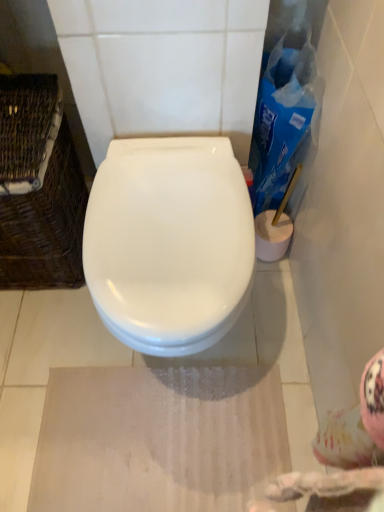
Question: Does point (158, 158) appear closer or farther from the camera than point (31, 260)?

Choices:
 (A) farther
 (B) closer

Answer: (B)

Question: From their relative heights in the image, would you say white glossy toilet at center is taller or shorter than woven brown basket at left?

Choices:
 (A) short
 (B) tall

Answer: (A)

Question: Based on their relative distances, which object is nearer to the white glossy toilet at center?

Choices:
 (A) woven brown basket at left
 (B) blue plastic cleaning product at right

Answer: (A)

Question: Considering the real-world distances, which object is farthest from the blue plastic cleaning product at right?

Choices:
 (A) white glossy toilet at center
 (B) woven brown basket at left

Answer: (B)